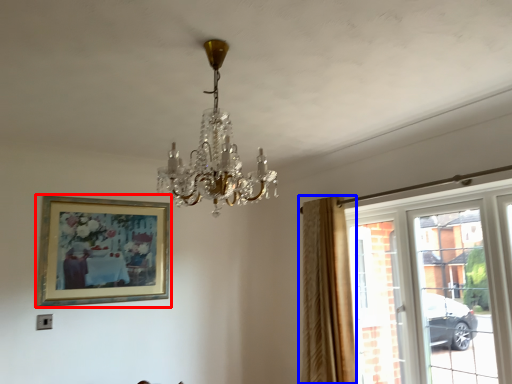
Question: Which object appears closest to the camera in this image, picture frame (highlighted by a red box) or curtain (highlighted by a blue box)?

Choices:
 (A) picture frame
 (B) curtain

Answer: (B)